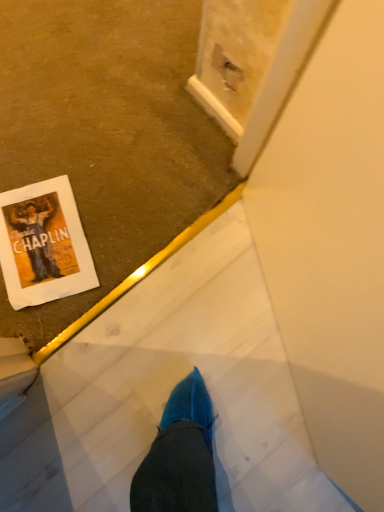
Describe the element at coordinates (43, 244) in the screenshot. Image resolution: width=384 pixels, height=512 pixels. I see `white paper at lower left` at that location.

Where is `white paper at lower left`? The width and height of the screenshot is (384, 512). white paper at lower left is located at coordinates (43, 244).

This screenshot has width=384, height=512. I want to click on white paper at lower left, so click(x=43, y=244).